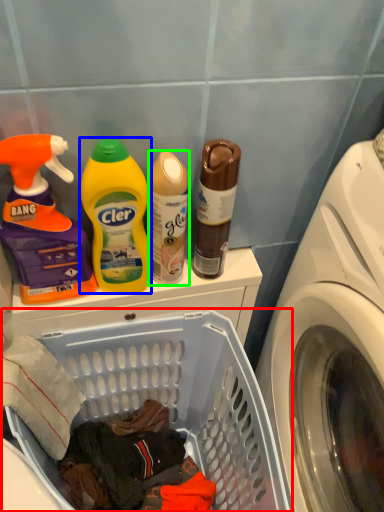
Question: Considering the real-world distances, which object is farthest from laundry basket (highlighted by a red box)? cleaning product (highlighted by a blue box) or cleaning product (highlighted by a green box)?

Choices:
 (A) cleaning product
 (B) cleaning product

Answer: (B)